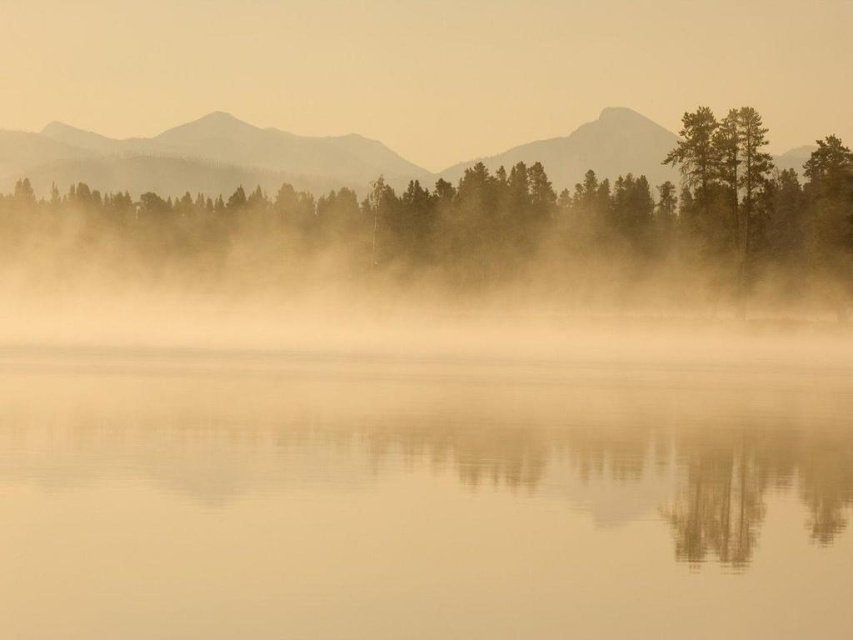
Does smooth water at center have a lesser height compared to green matte tree at center?

Correct, smooth water at center is not as tall as green matte tree at center.

Does smooth water at center appear over green matte tree at center?

Actually, smooth water at center is below green matte tree at center.

Which is in front, point (495, 422) or point (125, 260)?

Point (495, 422) is more forward.

The height and width of the screenshot is (640, 853). What are the coordinates of `smooth water at center` in the screenshot? It's located at (421, 499).